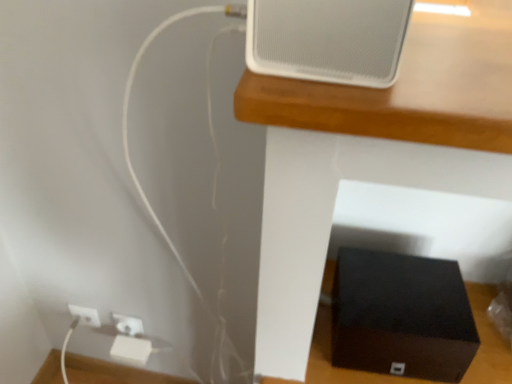
Question: Does black matte speaker at lower center have a lesser height compared to white matte speaker at upper center?

Choices:
 (A) yes
 (B) no

Answer: (B)

Question: Considering the relative sizes of black matte speaker at lower center and white matte speaker at upper center in the image provided, is black matte speaker at lower center wider than white matte speaker at upper center?

Choices:
 (A) no
 (B) yes

Answer: (B)

Question: Is black matte speaker at lower center facing away from white matte speaker at upper center?

Choices:
 (A) no
 (B) yes

Answer: (A)

Question: Considering the relative sizes of black matte speaker at lower center and white matte speaker at upper center in the image provided, is black matte speaker at lower center smaller than white matte speaker at upper center?

Choices:
 (A) yes
 (B) no

Answer: (B)

Question: Is black matte speaker at lower center facing towards white matte speaker at upper center?

Choices:
 (A) no
 (B) yes

Answer: (A)

Question: From the image's perspective, is black matte speaker at lower center below white matte speaker at upper center?

Choices:
 (A) yes
 (B) no

Answer: (A)

Question: Can you confirm if white plastic electric outlet at lower left is smaller than black matte box at lower right?

Choices:
 (A) no
 (B) yes

Answer: (B)

Question: Would you say white plastic electric outlet at lower left is outside black matte box at lower right?

Choices:
 (A) yes
 (B) no

Answer: (A)

Question: Does white plastic electric outlet at lower left lie in front of black matte box at lower right?

Choices:
 (A) no
 (B) yes

Answer: (A)

Question: Can you confirm if white plastic electric outlet at lower left is thinner than black matte box at lower right?

Choices:
 (A) yes
 (B) no

Answer: (A)

Question: Considering the relative positions of white plastic electric outlet at lower left and black matte box at lower right in the image provided, is white plastic electric outlet at lower left to the right of black matte box at lower right from the viewer's perspective?

Choices:
 (A) yes
 (B) no

Answer: (B)

Question: Can you confirm if white plastic electric outlet at lower left is positioned to the left of black matte box at lower right?

Choices:
 (A) no
 (B) yes

Answer: (B)

Question: From a real-world perspective, is black matte speaker at lower center over white plastic electric outlet at lower left?

Choices:
 (A) yes
 (B) no

Answer: (A)